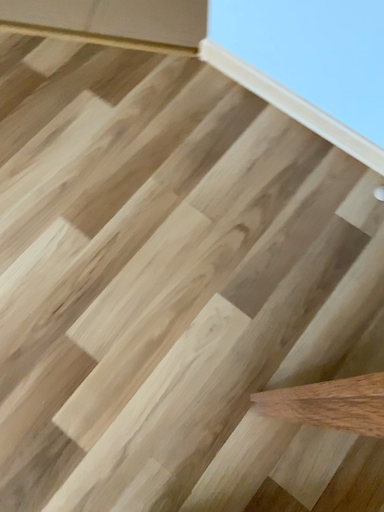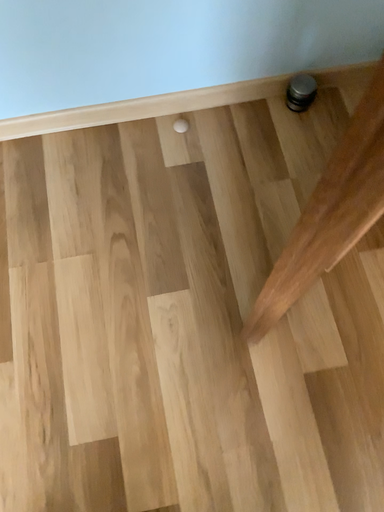
Question: Which way did the camera rotate in the video?

Choices:
 (A) rotated left
 (B) rotated right

Answer: (B)